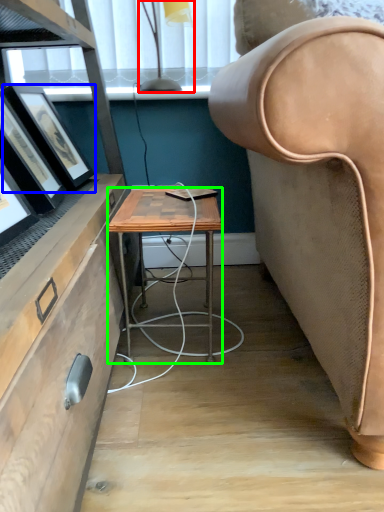
Question: Estimate the real-world distances between objects in this image. Which object is closer to lamp (highlighted by a red box), picture frame (highlighted by a blue box) or desk (highlighted by a green box)?

Choices:
 (A) picture frame
 (B) desk

Answer: (A)